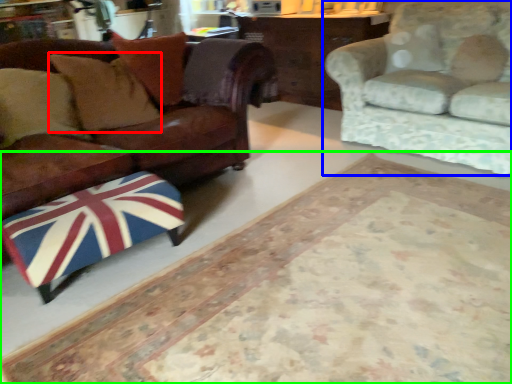
Question: Which is nearer to the pillow (highlighted by a red box)? studio couch (highlighted by a blue box) or mat (highlighted by a green box).

Choices:
 (A) studio couch
 (B) mat

Answer: (B)